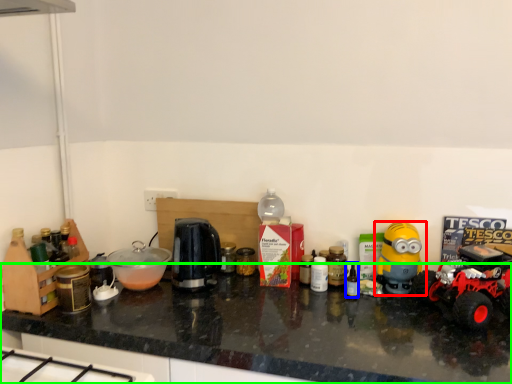
Question: Estimate the real-world distances between objects in this image. Which object is farther from toy (highlighted by a red box), bottle (highlighted by a blue box) or countertop (highlighted by a green box)?

Choices:
 (A) bottle
 (B) countertop

Answer: (B)